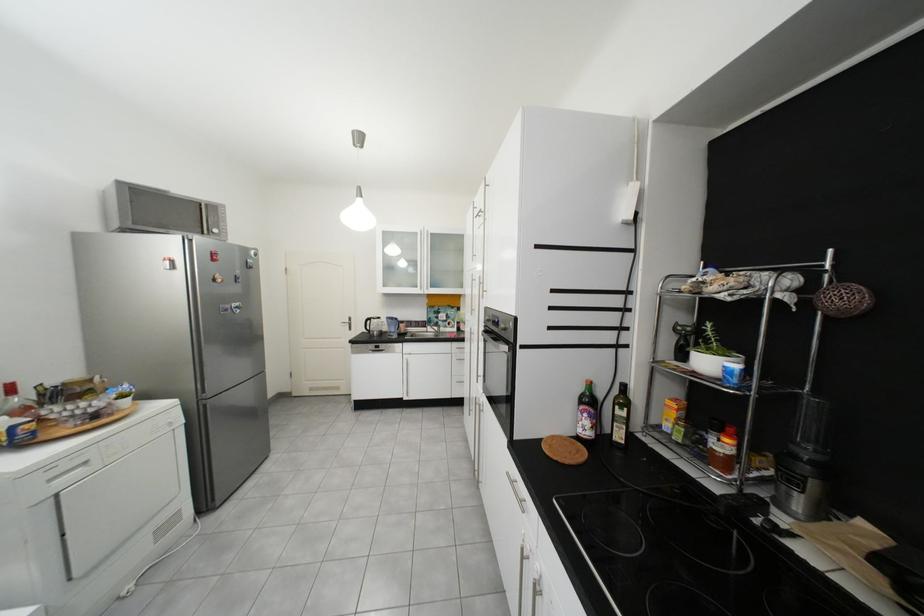
Where would you push the faucet handle? Please return your answer as a coordinate pair (x, y).

(433, 330)